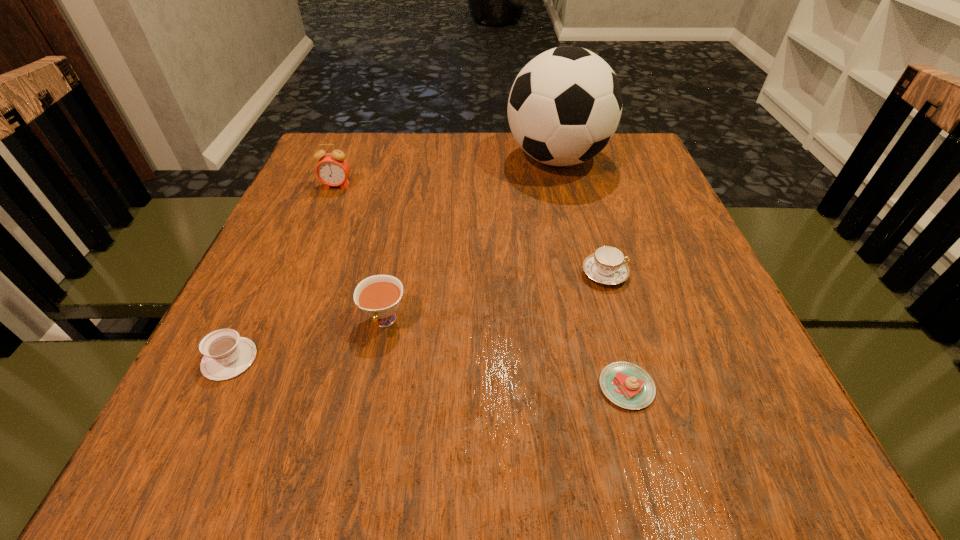
You are a GUI agent. You are given a task and a screenshot of the screen. Output one action in this format:
    pyautogui.click(x=<x>, y=<y>)
    Task: Click on the tallest object
    The height and width of the screenshot is (540, 960).
    Given the screenshot: What is the action you would take?
    pyautogui.click(x=565, y=105)

This screenshot has height=540, width=960. Identify the location of the second tallest object. pos(332,169).

You are a GUI agent. You are given a task and a screenshot of the screen. Output one action in this format:
    pyautogui.click(x=<x>, y=<y>)
    Task: Click on the second teacup from right to left
    This screenshot has width=960, height=540.
    Given the screenshot: What is the action you would take?
    pyautogui.click(x=378, y=296)

Find the location of a particular element. This screenshot has height=540, width=960. the fourth object from right to left is located at coordinates (378, 296).

Where is `the farthest teacup`? the farthest teacup is located at coordinates (607, 266).

This screenshot has height=540, width=960. I want to click on the third farthest object, so click(x=607, y=266).

You are a GUI agent. You are given a task and a screenshot of the screen. Output one action in this format:
    pyautogui.click(x=<x>, y=<y>)
    Task: Click on the leftmost teacup
    This screenshot has height=540, width=960.
    Given the screenshot: What is the action you would take?
    pyautogui.click(x=226, y=355)

Find the location of a particular element. The image size is (960, 540). pastry is located at coordinates (627, 385).

Identify the location of free space located on the front of the soccer ball. (580, 254).

I want to click on vacant space located 0.120m on the face of the alarm clock, so click(323, 222).